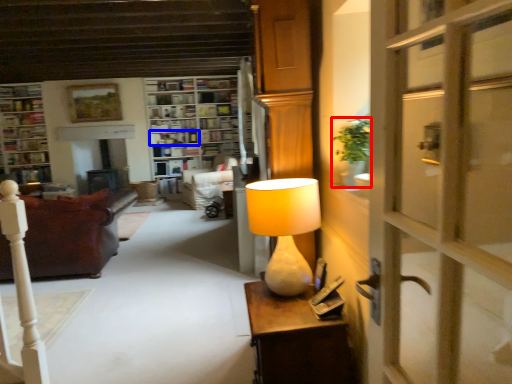
Question: Which object appears farthest to the camera in this image, houseplant (highlighted by a red box) or shelf (highlighted by a blue box)?

Choices:
 (A) houseplant
 (B) shelf

Answer: (B)